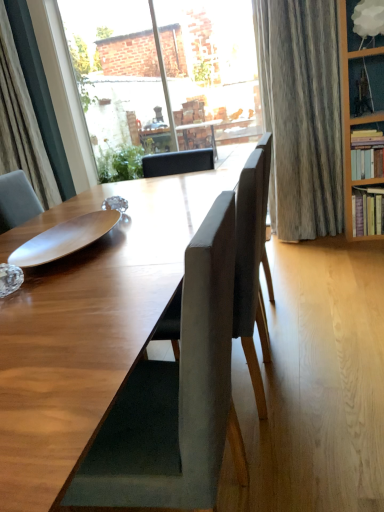
The image size is (384, 512). I want to click on free space above hardwood bookshelf at right, the 2th shelf when ordered from top to bottom (from a real-world perspective), so click(362, 128).